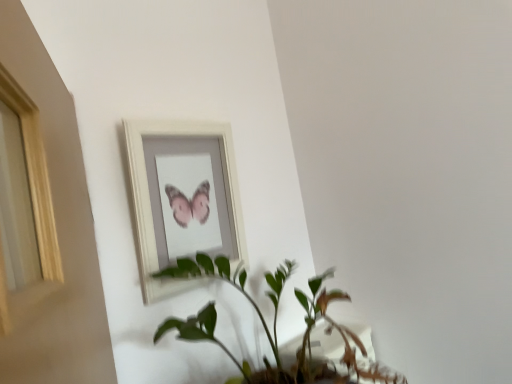
Question: Considering the relative sizes of white wooden picture frame at upper center and green leafy plant at center in the image provided, is white wooden picture frame at upper center taller than green leafy plant at center?

Choices:
 (A) no
 (B) yes

Answer: (B)

Question: Is white wooden picture frame at upper center further to camera compared to green leafy plant at center?

Choices:
 (A) yes
 (B) no

Answer: (A)

Question: Considering the relative sizes of white wooden picture frame at upper center and green leafy plant at center in the image provided, is white wooden picture frame at upper center bigger than green leafy plant at center?

Choices:
 (A) yes
 (B) no

Answer: (B)

Question: Considering the relative positions of white wooden picture frame at upper center and green leafy plant at center in the image provided, is white wooden picture frame at upper center in front of green leafy plant at center?

Choices:
 (A) no
 (B) yes

Answer: (A)

Question: Is white wooden picture frame at upper center at the right side of green leafy plant at center?

Choices:
 (A) yes
 (B) no

Answer: (B)

Question: From the image's perspective, is white wooden picture frame at upper center over green leafy plant at center?

Choices:
 (A) yes
 (B) no

Answer: (A)

Question: Is white wooden picture frame at upper center located within green leafy plant at center?

Choices:
 (A) yes
 (B) no

Answer: (B)

Question: Is green leafy plant at center outside white wooden picture frame at upper center?

Choices:
 (A) no
 (B) yes

Answer: (B)

Question: Considering the relative sizes of green leafy plant at center and white wooden picture frame at upper center in the image provided, is green leafy plant at center smaller than white wooden picture frame at upper center?

Choices:
 (A) yes
 (B) no

Answer: (B)

Question: From a real-world perspective, is green leafy plant at center over white wooden picture frame at upper center?

Choices:
 (A) no
 (B) yes

Answer: (A)

Question: Can you confirm if green leafy plant at center is wider than white wooden picture frame at upper center?

Choices:
 (A) yes
 (B) no

Answer: (A)

Question: From a real-world perspective, is green leafy plant at center beneath white wooden picture frame at upper center?

Choices:
 (A) no
 (B) yes

Answer: (B)

Question: From a real-world perspective, is green leafy plant at center above or below white wooden picture frame at upper center?

Choices:
 (A) below
 (B) above

Answer: (A)